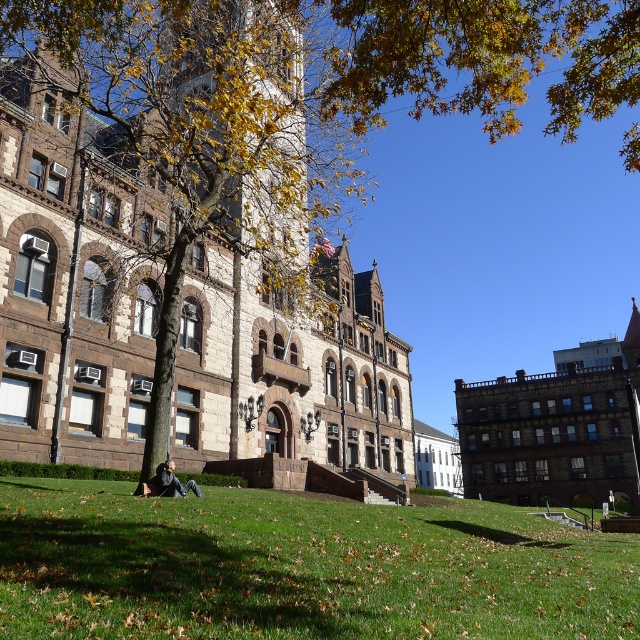
You are a photographer planning to take a picture of the autumn scene. You notice the green grass at lower center and the light brown hair at lower center in your frame. Which object will occupy more space in your photo?

The green grass at lower center occupies more space in the photo because it is larger than the light brown hair at lower center.

You are standing in front of the historic building with the clock tower and want to take a photo of the green grass at lower center and the light brown hair at lower center. Which object will appear larger in your photo?

The green grass at lower center will appear larger in the photo because it is closer to the viewer than the light brown hair at lower center.